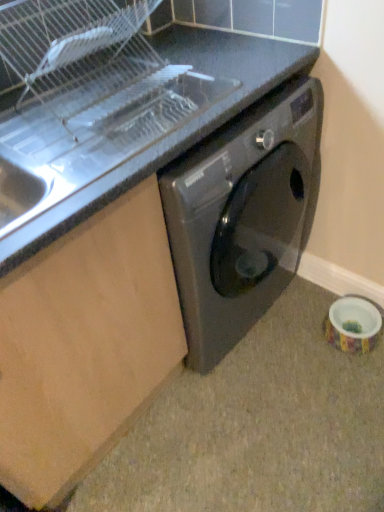
Where is `matte gray granite at lower right`? matte gray granite at lower right is located at coordinates (258, 426).

The width and height of the screenshot is (384, 512). Describe the element at coordinates (258, 426) in the screenshot. I see `matte gray granite at lower right` at that location.

I want to click on metallic stainless steel sink at upper left, so click(176, 129).

Describe the element at coordinates (176, 129) in the screenshot. The height and width of the screenshot is (512, 384). I see `metallic stainless steel sink at upper left` at that location.

Locate an element on the screen. Image resolution: width=384 pixels, height=512 pixels. matte gray granite at lower right is located at coordinates (258, 426).

Considering the positions of objects matte gray granite at lower right and metallic stainless steel sink at upper left in the image provided, who is more to the left, matte gray granite at lower right or metallic stainless steel sink at upper left?

metallic stainless steel sink at upper left.

Considering the positions of objects matte gray granite at lower right and metallic stainless steel sink at upper left in the image provided, who is behind, matte gray granite at lower right or metallic stainless steel sink at upper left?

matte gray granite at lower right is further away from the camera.

Which is behind, point (88, 499) or point (0, 242)?

The point (88, 499) is farther.

From the image's perspective, is matte gray granite at lower right located above or below metallic stainless steel sink at upper left?

matte gray granite at lower right is below metallic stainless steel sink at upper left.

In the scene shown: From a real-world perspective, which is physically below, matte gray granite at lower right or metallic stainless steel sink at upper left?

In real-world perspective, matte gray granite at lower right is lower.

Which object is wider, matte gray granite at lower right or metallic stainless steel sink at upper left?

Wider between the two is matte gray granite at lower right.

Considering the relative sizes of matte gray granite at lower right and metallic stainless steel sink at upper left in the image provided, is matte gray granite at lower right taller than metallic stainless steel sink at upper left?

Incorrect, the height of matte gray granite at lower right is not larger of that of metallic stainless steel sink at upper left.

Consider the image. Who is bigger, matte gray granite at lower right or metallic stainless steel sink at upper left?

metallic stainless steel sink at upper left.

Is matte gray granite at lower right inside the boundaries of metallic stainless steel sink at upper left, or outside?

matte gray granite at lower right is located beyond the bounds of metallic stainless steel sink at upper left.

Are matte gray granite at lower right and metallic stainless steel sink at upper left making contact?

No, matte gray granite at lower right is not next to metallic stainless steel sink at upper left.

Is matte gray granite at lower right oriented away from metallic stainless steel sink at upper left?

That's not correct — matte gray granite at lower right is not looking away from metallic stainless steel sink at upper left.

What's the angular difference between matte gray granite at lower right and metallic stainless steel sink at upper left's facing directions?

There is a 3.14e-05-degree angle between the facing directions of matte gray granite at lower right and metallic stainless steel sink at upper left.

How much distance is there between matte gray granite at lower right and metallic stainless steel sink at upper left?

matte gray granite at lower right and metallic stainless steel sink at upper left are 36.46 inches apart.

Locate an element on the screen. Image resolution: width=384 pixels, height=512 pixels. granite on the right of metallic stainless steel sink at upper left is located at coordinates (258, 426).

Which is more to the right, metallic stainless steel sink at upper left or matte gray granite at lower right?

Positioned to the right is matte gray granite at lower right.

Which is in front, metallic stainless steel sink at upper left or matte gray granite at lower right?

metallic stainless steel sink at upper left is more forward.

Considering the points (215, 128) and (374, 374), which point is behind, point (215, 128) or point (374, 374)?

The point (374, 374) is behind.

Looking at this image, from the image's perspective, who appears lower, metallic stainless steel sink at upper left or matte gray granite at lower right?

From the image's view, matte gray granite at lower right is below.

From a real-world perspective, is metallic stainless steel sink at upper left located higher than matte gray granite at lower right?

Yes, from a real-world perspective, metallic stainless steel sink at upper left is over matte gray granite at lower right

Consider the image. Which of these two, metallic stainless steel sink at upper left or matte gray granite at lower right, is thinner?

metallic stainless steel sink at upper left.

Which of these two, metallic stainless steel sink at upper left or matte gray granite at lower right, stands taller?

metallic stainless steel sink at upper left.

Does metallic stainless steel sink at upper left have a larger size compared to matte gray granite at lower right?

Yes.

Would you say metallic stainless steel sink at upper left is outside matte gray granite at lower right?

metallic stainless steel sink at upper left is positioned outside matte gray granite at lower right.

Is metallic stainless steel sink at upper left next to matte gray granite at lower right and touching it?

metallic stainless steel sink at upper left is not next to matte gray granite at lower right, and they're not touching.

Is metallic stainless steel sink at upper left positioned with its back to matte gray granite at lower right?

No, matte gray granite at lower right is not at the back of metallic stainless steel sink at upper left.

How many degrees apart are the facing directions of metallic stainless steel sink at upper left and matte gray granite at lower right?

metallic stainless steel sink at upper left and matte gray granite at lower right are facing 3.14e-05 degrees away from each other.

In the image, there is a metallic stainless steel sink at upper left. What are the coordinates of `granite below it (from a real-world perspective)` in the screenshot? It's located at (258, 426).

Find the location of a particular element. counter top above the matte gray granite at lower right (from a real-world perspective) is located at coordinates (176, 129).

Find the location of `counter top on the left of the matte gray granite at lower right`. counter top on the left of the matte gray granite at lower right is located at coordinates (176, 129).